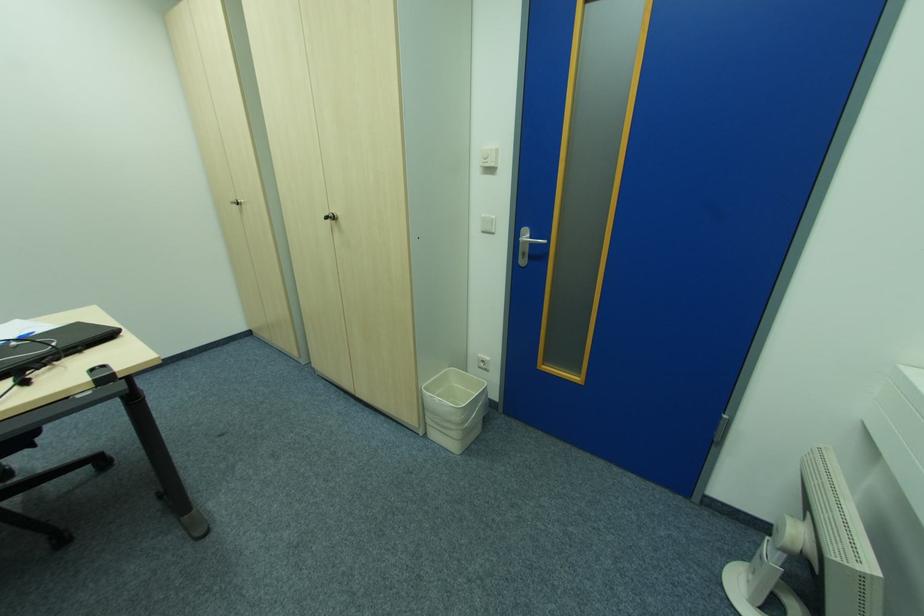
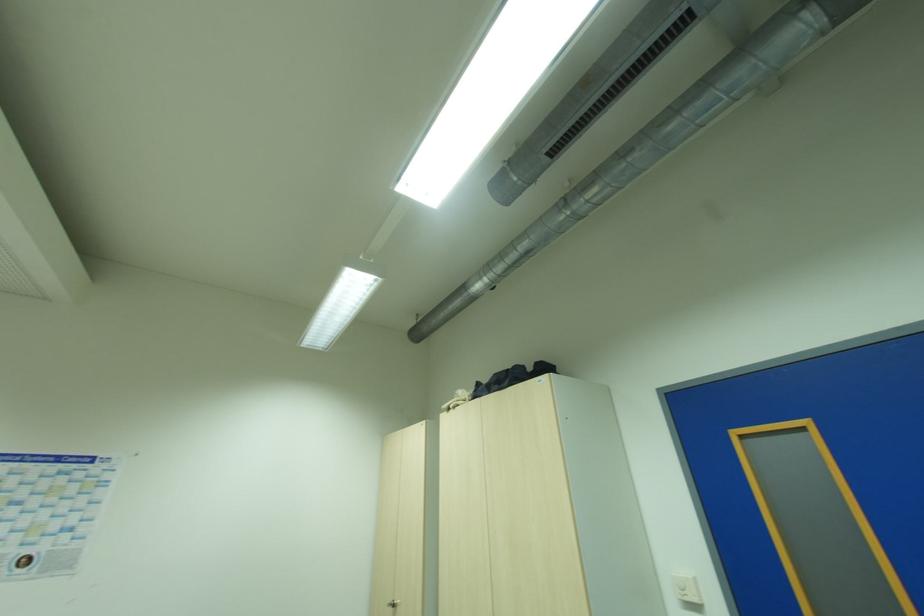
First-person continuous shooting, in which direction is the camera rotating?

The rotation direction of the camera is left-up.